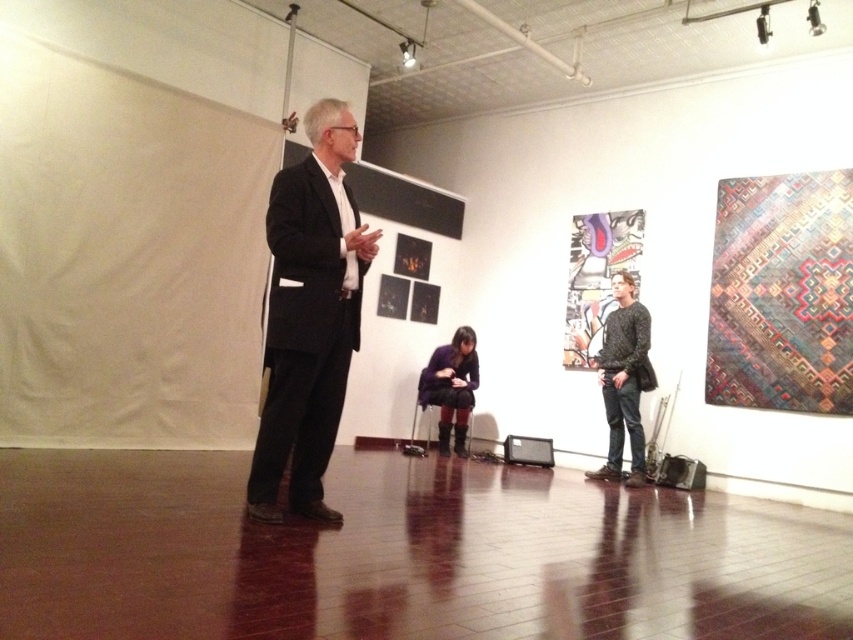
Does matte black suit at center appear over purple fuzzy sweater at center?

Indeed, matte black suit at center is positioned over purple fuzzy sweater at center.

Does matte black suit at center have a larger size compared to purple fuzzy sweater at center?

Correct, matte black suit at center is larger in size than purple fuzzy sweater at center.

Is point (312, 355) more distant than point (442, 384)?

No.

This screenshot has width=853, height=640. What are the coordinates of `matte black suit at center` in the screenshot? It's located at (309, 316).

Is knitted sweater at right positioned at the back of purple fuzzy sweater at center?

No, knitted sweater at right is in front of purple fuzzy sweater at center.

Is point (602, 376) positioned behind point (433, 349)?

No.

This screenshot has width=853, height=640. What are the coordinates of `knitted sweater at right` in the screenshot? It's located at (624, 380).

Locate an element on the screen. The height and width of the screenshot is (640, 853). knitted sweater at right is located at coordinates (624, 380).

Can you confirm if matte black suit at center is positioned to the right of knitted sweater at right?

Incorrect, matte black suit at center is not on the right side of knitted sweater at right.

How far apart are matte black suit at center and knitted sweater at right?

The distance of matte black suit at center from knitted sweater at right is 3.50 meters.

Who is more distant from viewer, [289,449] or [639,484]?

Point [639,484]

Image resolution: width=853 pixels, height=640 pixels. Find the location of `matte black suit at center`. matte black suit at center is located at coordinates (309, 316).